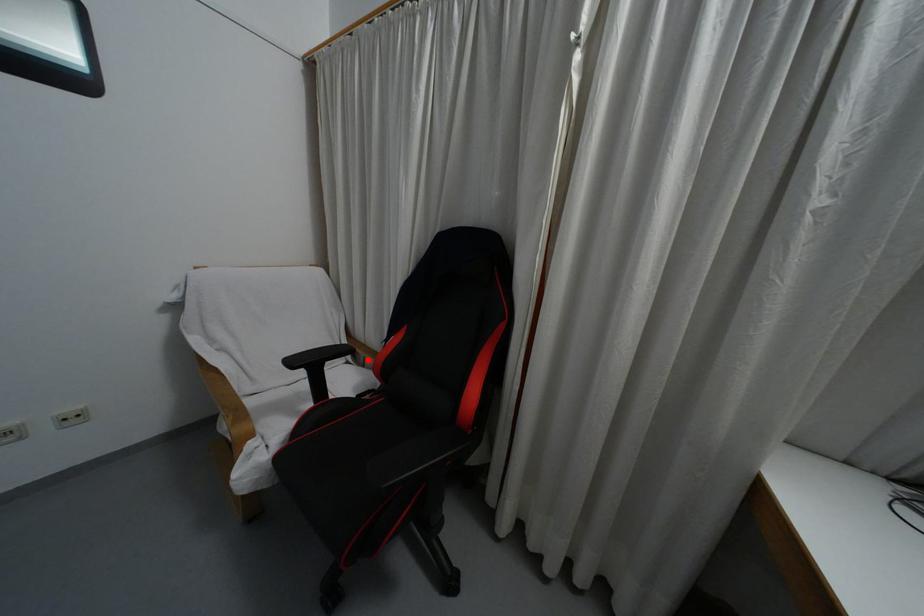
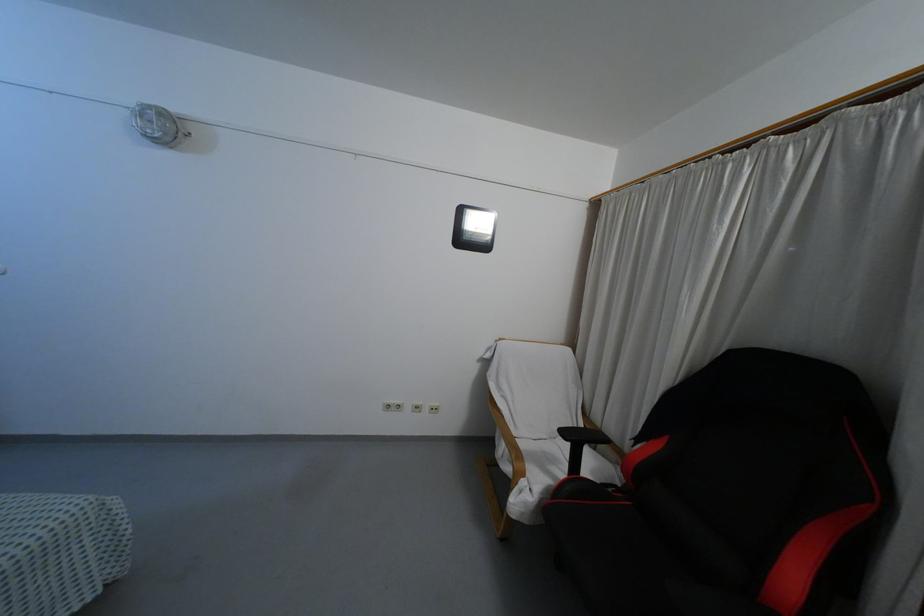
Where in the second image is the point corresponding to the highlighted location from the first image?

(600, 446)